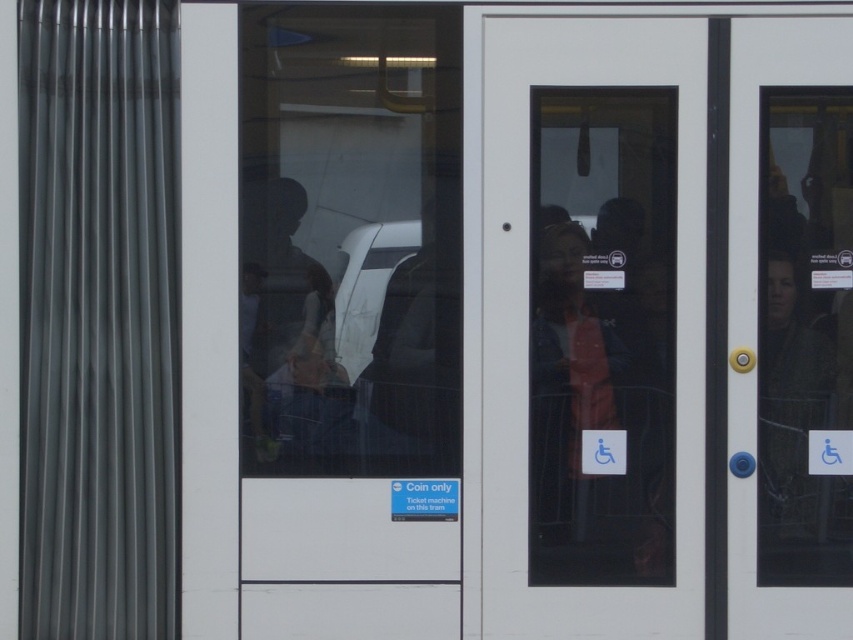
Identify the location of white glossy door at center. The width and height of the screenshot is (853, 640). (526, 310).

Is white glossy door at center above matte black jacket at center?

Indeed, white glossy door at center is positioned over matte black jacket at center.

Does point (474, 192) come in front of point (547, 410)?

Yes, point (474, 192) is in front of point (547, 410).

I want to click on white glossy door at center, so click(x=526, y=310).